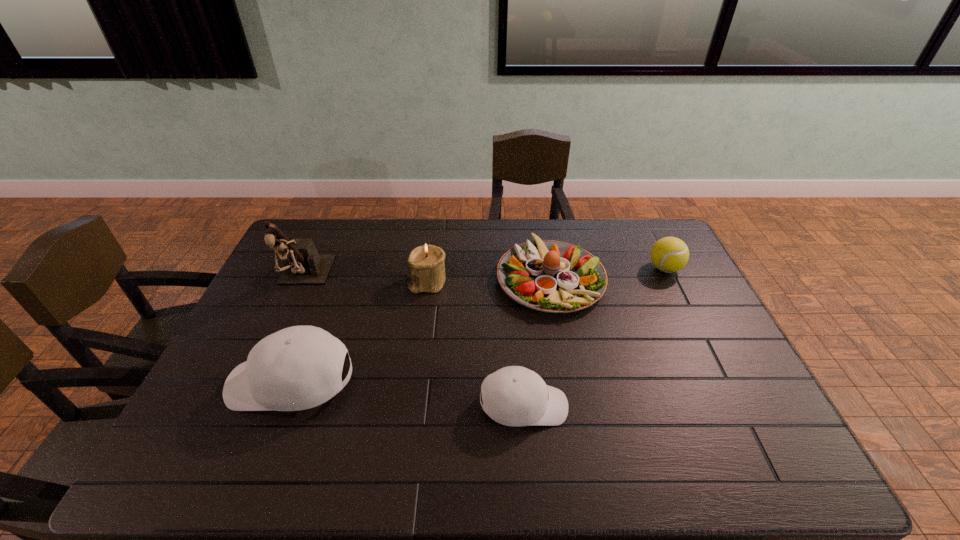
Observe the arrangement of all baseball caps in the image. To keep them evenly spaced, where would you place another baseball cap on the right? Please locate a free space. Please provide its 2D coordinates. Your answer should be formatted as a tuple, i.e. [(x, y)], where the tuple contains the x and y coordinates of a point satisfying the conditions above.

[(779, 431)]